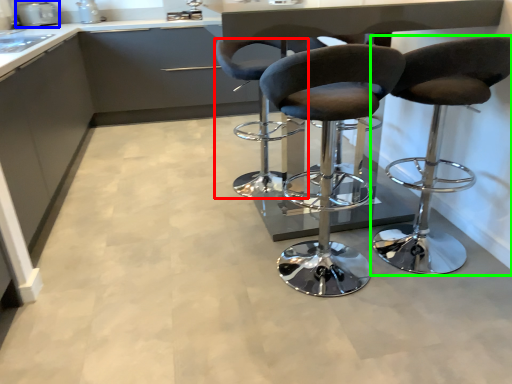
Question: Considering the real-world distances, which object is closest to chair (highlighted by a red box)? appliance (highlighted by a blue box) or chair (highlighted by a green box).

Choices:
 (A) appliance
 (B) chair

Answer: (B)